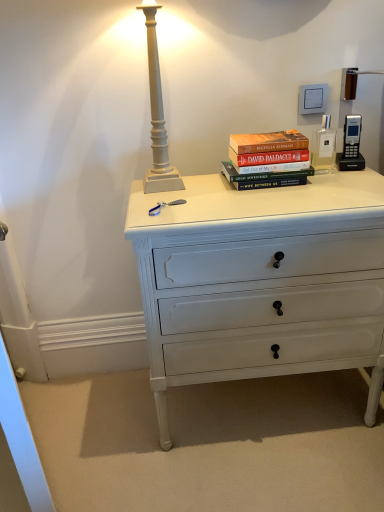
At what (x,y) coordinates should I click in order to perform the action: click on free space in front of hardcover books at center. Please return your answer as a coordinate pair (x, y). Looking at the image, I should click on (297, 200).